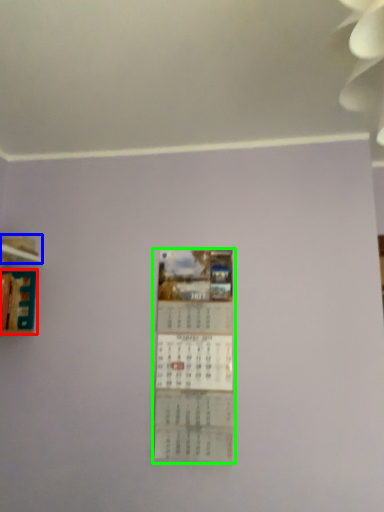
Question: Which object is the closest to the book (highlighted by a red box)? Choose among these: shelf (highlighted by a blue box) or poster (highlighted by a green box).

Choices:
 (A) shelf
 (B) poster

Answer: (A)